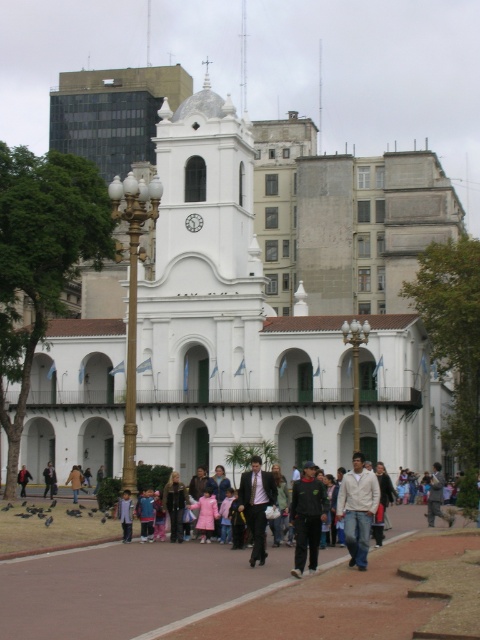
Between dark green uniform at center and light blue denim jacket at center, which one is positioned higher?

dark green uniform at center is above.

Can you confirm if dark green uniform at center is bigger than light blue denim jacket at center?

Yes, dark green uniform at center is bigger than light blue denim jacket at center.

Find the location of a particular element. The height and width of the screenshot is (640, 480). dark green uniform at center is located at coordinates tap(308, 516).

I want to click on dark green uniform at center, so click(308, 516).

Which is above, smooth concrete pavement at center or white matte jacket at center?

white matte jacket at center is higher up.

Looking at this image, between smooth concrete pavement at center and white matte jacket at center, which one has more height?

white matte jacket at center is taller.

Is point (34, 563) positioned after point (369, 538)?

Yes.

The image size is (480, 640). I want to click on smooth concrete pavement at center, so click(x=123, y=588).

Can you confirm if white matte jacket at center is taller than light pink fabric coat at center?

Yes, white matte jacket at center is taller than light pink fabric coat at center.

Describe the element at coordinates (358, 508) in the screenshot. I see `white matte jacket at center` at that location.

Is point (348, 534) behind point (55, 480)?

That is False.

The image size is (480, 640). I want to click on white matte jacket at center, so click(x=358, y=508).